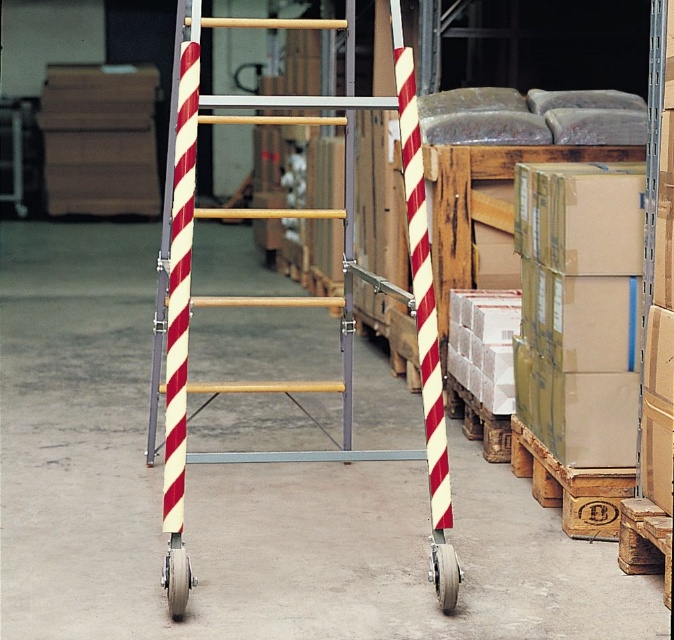
Which of these two, metallic silver ladder at center or gray rubber wheel at lower center, stands taller?

metallic silver ladder at center is taller.

Is metallic silver ladder at center to the left of gray rubber wheel at lower center from the viewer's perspective?

Yes, metallic silver ladder at center is to the left of gray rubber wheel at lower center.

Locate an element on the screen. The image size is (674, 640). metallic silver ladder at center is located at coordinates (290, 296).

Can you confirm if red and white striped ladder at center is positioned above gray rubber wheel at lower left?

Indeed, red and white striped ladder at center is positioned over gray rubber wheel at lower left.

You are a GUI agent. You are given a task and a screenshot of the screen. Output one action in this format:
    pyautogui.click(x=<x>, y=<y>)
    Task: Click on the red and white striped ladder at center
    Image resolution: width=674 pixels, height=640 pixels.
    Given the screenshot: What is the action you would take?
    pos(290,301)

This screenshot has height=640, width=674. I want to click on red and white striped ladder at center, so click(x=290, y=301).

Who is shorter, gray rubber wheel at lower left or gray rubber wheel at lower center?

gray rubber wheel at lower center

Is gray rubber wheel at lower left closer to the viewer compared to gray rubber wheel at lower center?

Yes, gray rubber wheel at lower left is closer to the viewer.

Is point (166, 557) more distant than point (439, 557)?

That is False.

The height and width of the screenshot is (640, 674). Find the location of `gray rubber wheel at lower left`. gray rubber wheel at lower left is located at coordinates (177, 580).